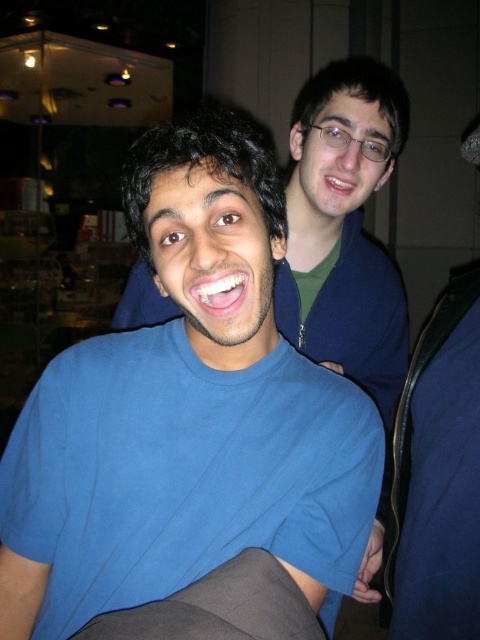
Question: Which of these objects is positioned farthest from the blue cotton shirt at center?

Choices:
 (A) matte skin at upper right
 (B) white glossy teeth at center

Answer: (A)

Question: In this image, where is white glossy teeth at center located relative to matte skin at upper right?

Choices:
 (A) right
 (B) left

Answer: (B)

Question: Which point is closer to the camera?

Choices:
 (A) matte skin at upper right
 (B) white glossy teeth at center

Answer: (B)

Question: Is blue cotton shirt at center above white glossy teeth at center?

Choices:
 (A) yes
 (B) no

Answer: (B)

Question: Can you confirm if blue cotton shirt at center is positioned above matte skin at upper right?

Choices:
 (A) no
 (B) yes

Answer: (A)

Question: Which object is positioned closest to the white glossy teeth at center?

Choices:
 (A) matte skin at upper right
 (B) blue cotton shirt at center

Answer: (B)